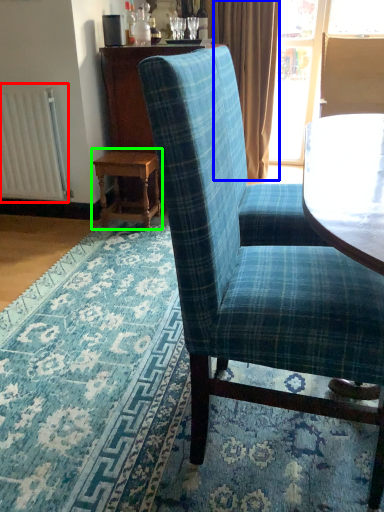
Question: Which is farther away from radiator (highlighted by a red box)? curtain (highlighted by a blue box) or table (highlighted by a green box)?

Choices:
 (A) curtain
 (B) table

Answer: (A)